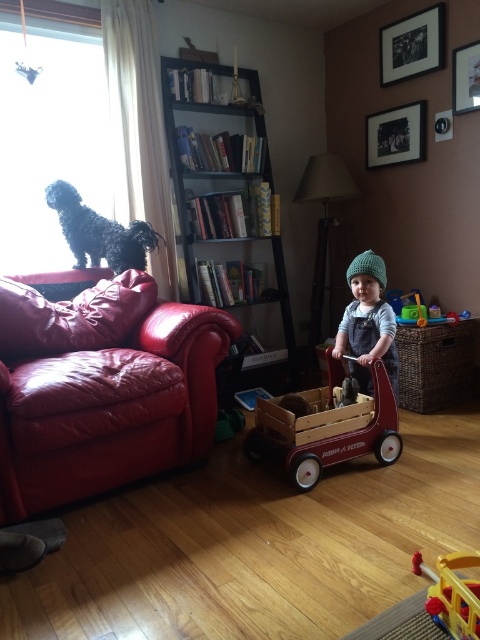
You are standing at point (264,125) and want to walk to the window. The distance between you and the window is 11.62 feet. If your walking speed is 3 feet per second, how many seconds will it take you to reach the window?

The distance between the point (264,125) and the window is 11.62 feet. At a speed of 3 feet per second, it will take 11.62 divided by 3, which is approximately 3.87 seconds to reach the window.

You are standing in the living room and want to place a new decorative item exactly at the point with coordinates [325,428]. What object is located at that point?

The point at coordinates [325,428] corresponds to the wooden wagon at center, so placing the decorative item there would cover the wagon.

You have a toy that needs to be placed on the floor. The wooden wagon at center is currently occupying space. Can the metallic silver picture frame at upper right fit in the space where the wagon is now?

The wooden wagon at center might be wider than metallic silver picture frame at upper right, so there is a possibility that the picture frame can fit in the wagon space, but it depends on the exact dimensions.